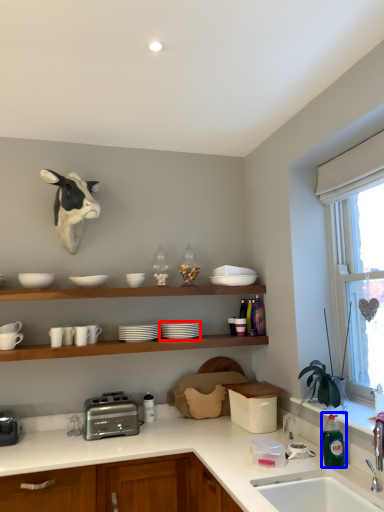
Question: Which point is closer to the camera, tableware (highlighted by a red box) or bottle (highlighted by a blue box)?

Choices:
 (A) tableware
 (B) bottle

Answer: (B)